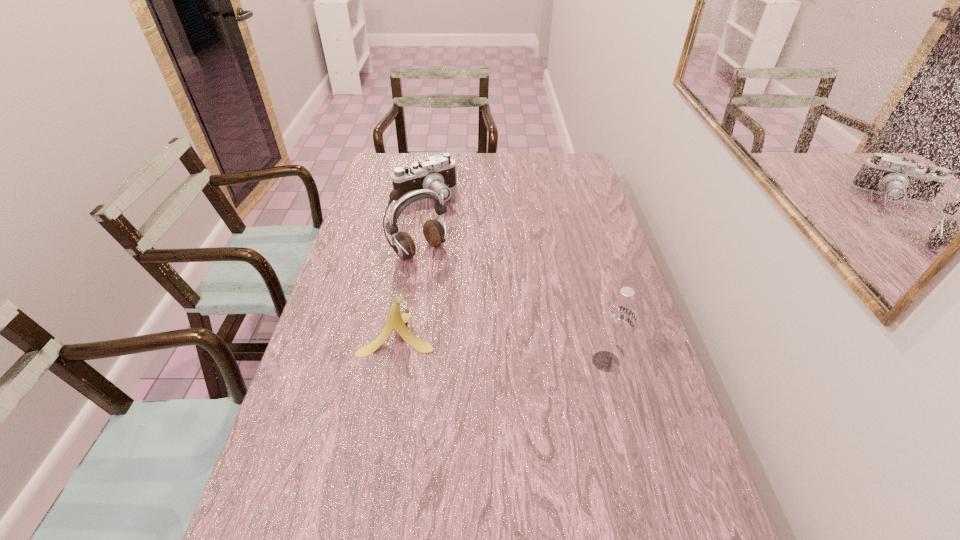
I want to click on banana, so click(395, 320).

The image size is (960, 540). Find the location of `vodka`. vodka is located at coordinates (618, 321).

You are a GUI agent. You are given a task and a screenshot of the screen. Output one action in this format:
    pyautogui.click(x=<x>, y=<y>)
    Task: Click on the farthest object
    This screenshot has height=540, width=960.
    Given the screenshot: What is the action you would take?
    pyautogui.click(x=437, y=173)

Locate an element on the screen. This screenshot has height=540, width=960. earphone is located at coordinates tap(434, 233).

Identify the location of free space located 0.110m on the right of the banana. (475, 333).

Locate an element on the screen. vacant space situated 0.070m on the front label of the vodka is located at coordinates click(x=649, y=361).

This screenshot has width=960, height=540. I want to click on vacant space located 0.320m at the lens of the farthest object, so click(x=467, y=261).

This screenshot has width=960, height=540. I want to click on free space located at the lens of the farthest object, so click(x=474, y=275).

Locate an element on the screen. This screenshot has width=960, height=540. free space located at the lens of the farthest object is located at coordinates (449, 233).

Locate an element on the screen. The image size is (960, 540). free location located 0.130m on the ear pads of the third nearest object is located at coordinates (458, 286).